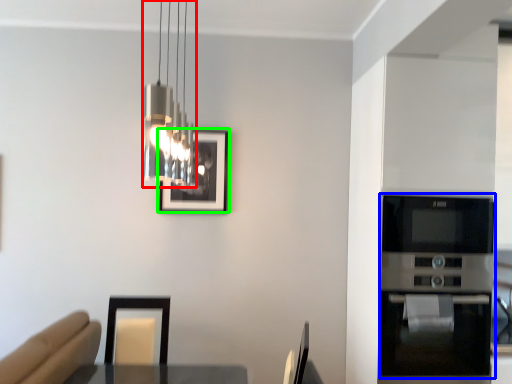
Question: Which object is the farthest from lamp (highlighted by a red box)? Choose among these: appliance (highlighted by a blue box) or picture frame (highlighted by a green box).

Choices:
 (A) appliance
 (B) picture frame

Answer: (A)